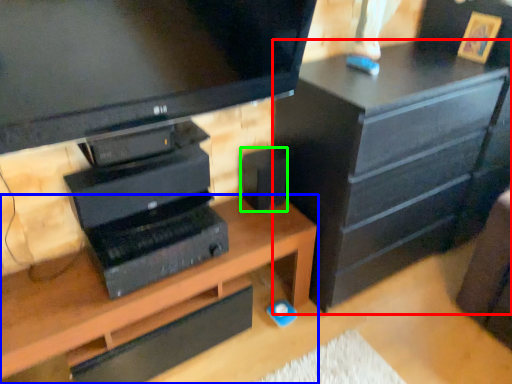
Question: Which object is positioned farthest from chest of drawers (highlighted by a red box)? Select from desk (highlighted by a blue box) and speaker (highlighted by a green box).

Choices:
 (A) desk
 (B) speaker

Answer: (A)